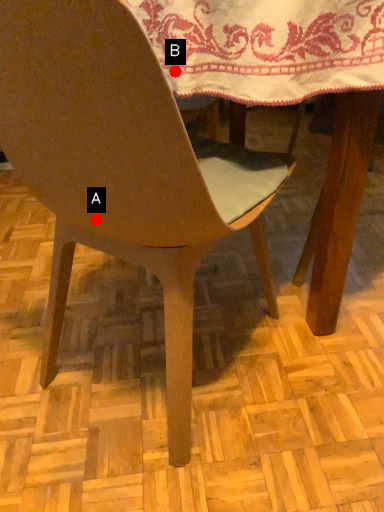
Question: Two points are circled on the image, labeled by A and B beside each circle. Among these points, which one is nearest to the camera?

Choices:
 (A) A is closer
 (B) B is closer

Answer: (A)